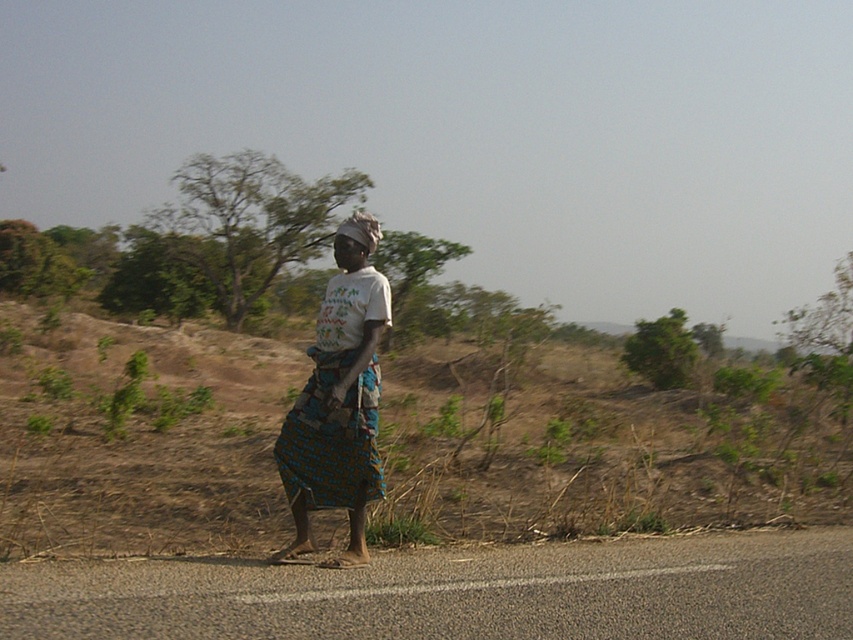
Question: Which object appears farthest from the camera in this image?

Choices:
 (A) printed fabric skirt at center
 (B) blue printed fabric dress at center

Answer: (B)

Question: From the image, what is the correct spatial relationship of printed fabric skirt at center in relation to dark brown fabric headscarf at center?

Choices:
 (A) below
 (B) above

Answer: (A)

Question: Based on their relative distances, which object is farther from the printed fabric skirt at center?

Choices:
 (A) dark brown fabric headscarf at center
 (B) blue printed fabric dress at center

Answer: (A)

Question: Among these objects, which one is farthest from the camera?

Choices:
 (A) dark brown fabric headscarf at center
 (B) blue printed fabric dress at center

Answer: (A)

Question: Is the position of blue printed fabric dress at center less distant than that of dark brown fabric headscarf at center?

Choices:
 (A) yes
 (B) no

Answer: (A)

Question: Can you confirm if blue printed fabric dress at center is positioned to the right of dark brown fabric headscarf at center?

Choices:
 (A) yes
 (B) no

Answer: (A)